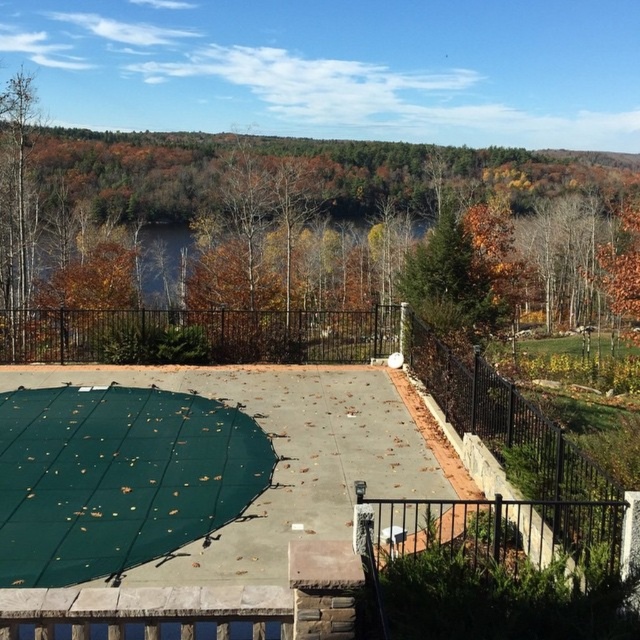
Based on the photo, does green matte fence at upper center have a smaller size compared to green mesh at center?

Actually, green matte fence at upper center might be larger than green mesh at center.

Does point (300, 232) come farther from viewer compared to point (113, 492)?

Yes, it is behind point (113, 492).

This screenshot has height=640, width=640. What do you see at coordinates (298, 243) in the screenshot?
I see `green matte fence at upper center` at bounding box center [298, 243].

You are a GUI agent. You are given a task and a screenshot of the screen. Output one action in this format:
    pyautogui.click(x=<x>, y=<y>)
    Task: Click on the green matte fence at upper center
    
    Given the screenshot: What is the action you would take?
    pyautogui.click(x=298, y=243)